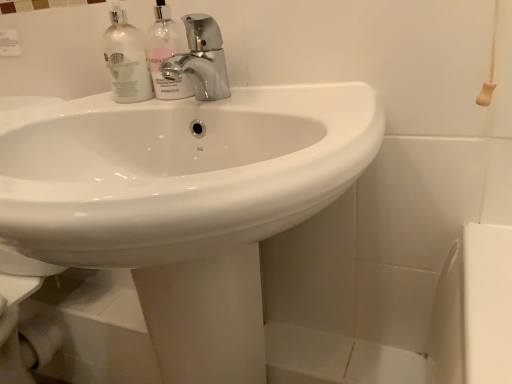
Question: Does translucent glass bottles at upper left, which is the second cleaning product from right to left, turn towards clear glass bottle at upper center, which is counted as the first cleaning product, starting from the right?

Choices:
 (A) yes
 (B) no

Answer: (B)

Question: Can you confirm if translucent glass bottles at upper left, which is counted as the 1th cleaning product, starting from the left, is bigger than clear glass bottle at upper center, positioned as the second cleaning product in left-to-right order?

Choices:
 (A) yes
 (B) no

Answer: (A)

Question: Is translucent glass bottles at upper left, which is counted as the 1th cleaning product, starting from the left, next to clear glass bottle at upper center, which is counted as the first cleaning product, starting from the right?

Choices:
 (A) no
 (B) yes

Answer: (B)

Question: Can you confirm if translucent glass bottles at upper left, which is counted as the 1th cleaning product, starting from the left, is smaller than clear glass bottle at upper center, which is counted as the first cleaning product, starting from the right?

Choices:
 (A) yes
 (B) no

Answer: (B)

Question: Is translucent glass bottles at upper left, which is the second cleaning product from right to left, not within clear glass bottle at upper center, which is counted as the first cleaning product, starting from the right?

Choices:
 (A) no
 (B) yes

Answer: (B)

Question: Is chrome metallic faucet at center taller or shorter than clear glass bottle at upper center, positioned as the second cleaning product in left-to-right order?

Choices:
 (A) short
 (B) tall

Answer: (A)

Question: Looking at their shapes, would you say chrome metallic faucet at center is wider or thinner than clear glass bottle at upper center, positioned as the second cleaning product in left-to-right order?

Choices:
 (A) wide
 (B) thin

Answer: (A)

Question: Is chrome metallic faucet at center bigger or smaller than clear glass bottle at upper center, which is counted as the first cleaning product, starting from the right?

Choices:
 (A) small
 (B) big

Answer: (B)

Question: Would you say chrome metallic faucet at center is inside or outside clear glass bottle at upper center, positioned as the second cleaning product in left-to-right order?

Choices:
 (A) outside
 (B) inside

Answer: (A)

Question: Considering the positions of white glossy sink at center and chrome metallic faucet at center in the image, is white glossy sink at center bigger or smaller than chrome metallic faucet at center?

Choices:
 (A) big
 (B) small

Answer: (A)

Question: From the image's perspective, is white glossy sink at center located above or below chrome metallic faucet at center?

Choices:
 (A) below
 (B) above

Answer: (A)

Question: In the image, is white glossy sink at center positioned in front of or behind chrome metallic faucet at center?

Choices:
 (A) behind
 (B) front

Answer: (B)

Question: Is point (150, 238) positioned closer to the camera than point (161, 72)?

Choices:
 (A) farther
 (B) closer

Answer: (B)

Question: From a real-world perspective, is white glossy sink at center physically located above or below clear glass bottle at upper center, positioned as the second cleaning product in left-to-right order?

Choices:
 (A) above
 (B) below

Answer: (B)

Question: Is white glossy sink at center bigger or smaller than clear glass bottle at upper center, which is counted as the first cleaning product, starting from the right?

Choices:
 (A) big
 (B) small

Answer: (A)